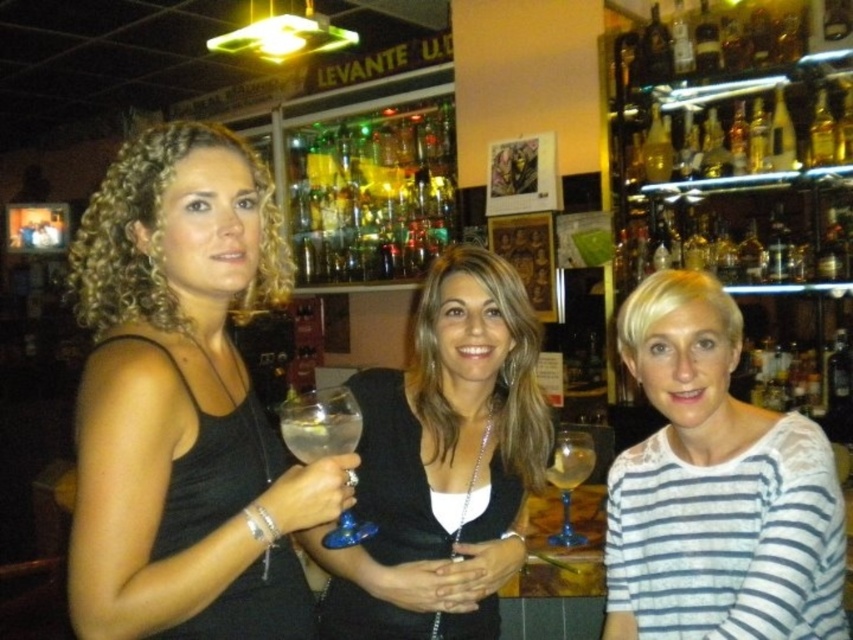
Question: Which is farther from the clear glass wine glass at center?

Choices:
 (A) black matte dress at center
 (B) black matte tank top at left
 (C) transparent glass wine glass at center

Answer: (B)

Question: Which object appears farthest from the camera in this image?

Choices:
 (A) black matte tank top at left
 (B) white striped shirt at lower right

Answer: (B)

Question: Is translucent glass bottles at upper center above clear glass wine glass at center?

Choices:
 (A) no
 (B) yes

Answer: (B)

Question: Is white striped shirt at lower right thinner than translucent glass bottles at upper center?

Choices:
 (A) no
 (B) yes

Answer: (B)

Question: Is black matte tank top at left to the right of white striped shirt at lower right from the viewer's perspective?

Choices:
 (A) yes
 (B) no

Answer: (B)

Question: Estimate the real-world distances between objects in this image. Which object is farther from the black matte tank top at left?

Choices:
 (A) white striped shirt at lower right
 (B) clear glass wine glass at center

Answer: (B)